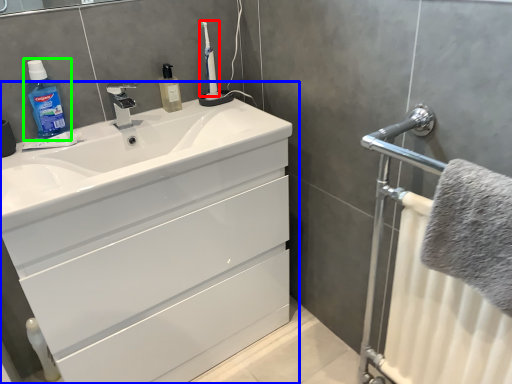
Question: Which is farther away from toothbrush (highlighted by a red box)? bathroom cabinet (highlighted by a blue box) or cleaning product (highlighted by a green box)?

Choices:
 (A) bathroom cabinet
 (B) cleaning product

Answer: (A)